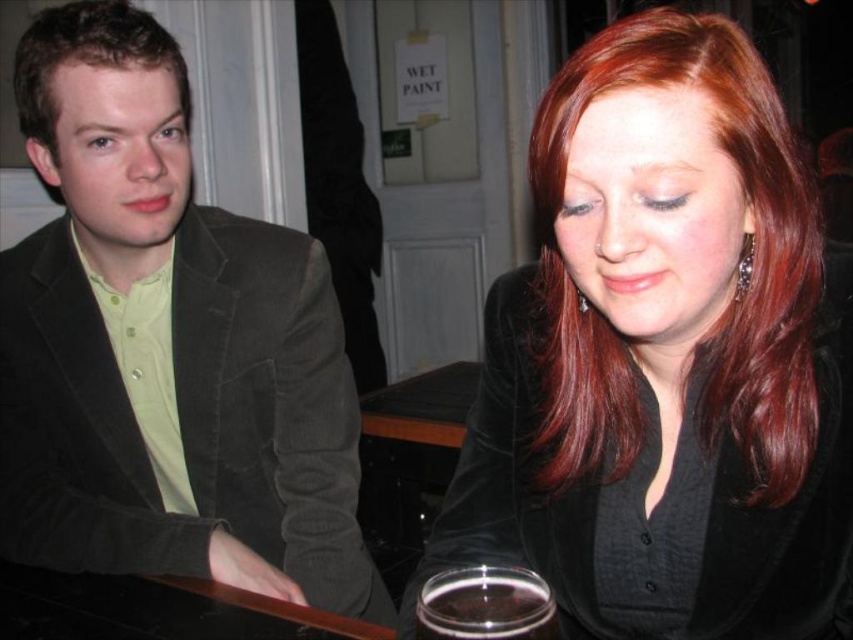
You are standing at the camera position in the image. There is a point at coordinates point [111,38]. Can you reach this point with your outstretched hand without moving your feet?

The point at coordinates point [111,38] is 38.85 inches away from the camera, which is approximately 3.24 feet. Since the average human arm length is about 2.5 feet, you cannot reach it with your outstretched hand without moving your feet.

You are a customer at a bar and you want to grab the clear glass cup at lower center without touching the shiny red hair at upper right. Is it possible?

The shiny red hair at upper right is above the clear glass cup at lower center, so you can reach the clear glass cup at lower center without touching the shiny red hair at upper right by moving your hand underneath it.

You are a photographer holding a camera and want to take a closeup shot of the black velvet blazer at center without moving the camera. Can you do that?

The black velvet blazer at center and camera are 25.23 inches apart, so yes, you can take a closeup shot of the black velvet blazer at center without moving the camera.